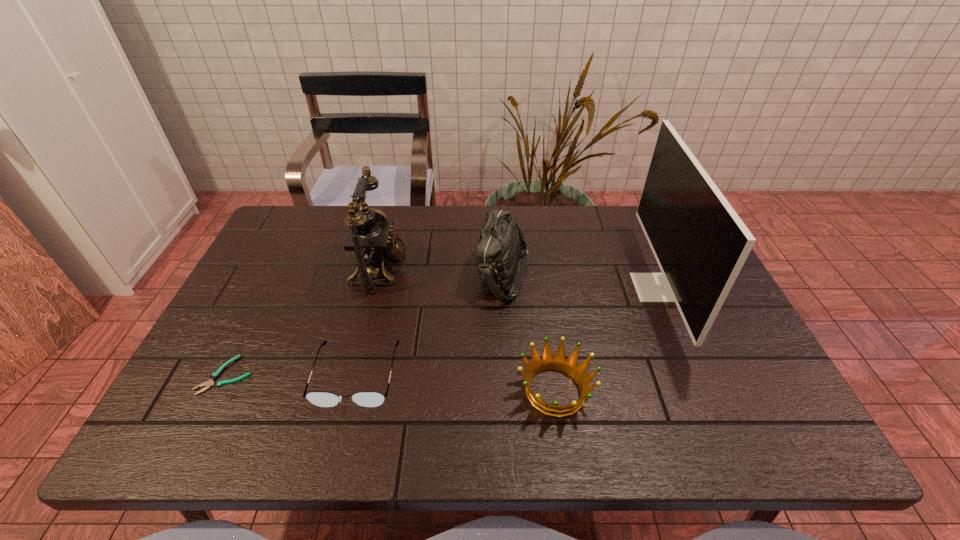
Identify the location of shoulder bag present at the far edge. (501, 243).

At what (x,y) coordinates should I click in order to perform the action: click on object at the near edge. Please return your answer as a coordinate pair (x, y). The width and height of the screenshot is (960, 540). Looking at the image, I should click on (548, 362).

Locate an element on the screen. object that is at the left edge is located at coordinates (215, 375).

The height and width of the screenshot is (540, 960). Identify the location of object that is at the right edge. (700, 243).

Find the location of `object that is at the far right corner`. object that is at the far right corner is located at coordinates (700, 243).

The width and height of the screenshot is (960, 540). Find the location of `vacant space at the far edge`. vacant space at the far edge is located at coordinates (528, 217).

Locate an element on the screen. The width and height of the screenshot is (960, 540). vacant space at the near edge is located at coordinates (420, 448).

Locate an element on the screen. blank area at the left edge is located at coordinates (307, 264).

Identify the location of vacant space at the near left corner of the desktop. (171, 441).

Locate an element on the screen. The width and height of the screenshot is (960, 540). vacant space at the near right corner of the desktop is located at coordinates (779, 414).